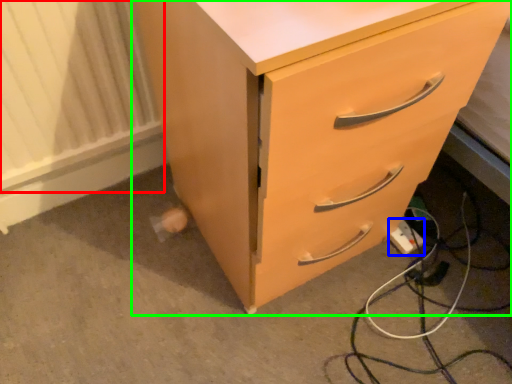
Question: Which is farther away from radiator (highlighted by a red box)? extension cord (highlighted by a blue box) or chest of drawers (highlighted by a green box)?

Choices:
 (A) extension cord
 (B) chest of drawers

Answer: (A)